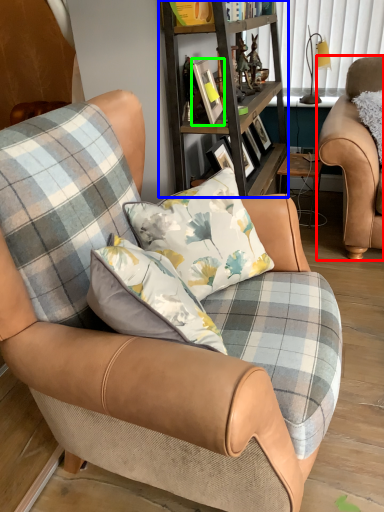
Question: Which is nearer to the chair (highlighted by a red box)? shelf (highlighted by a blue box) or picture frame (highlighted by a green box).

Choices:
 (A) shelf
 (B) picture frame

Answer: (A)